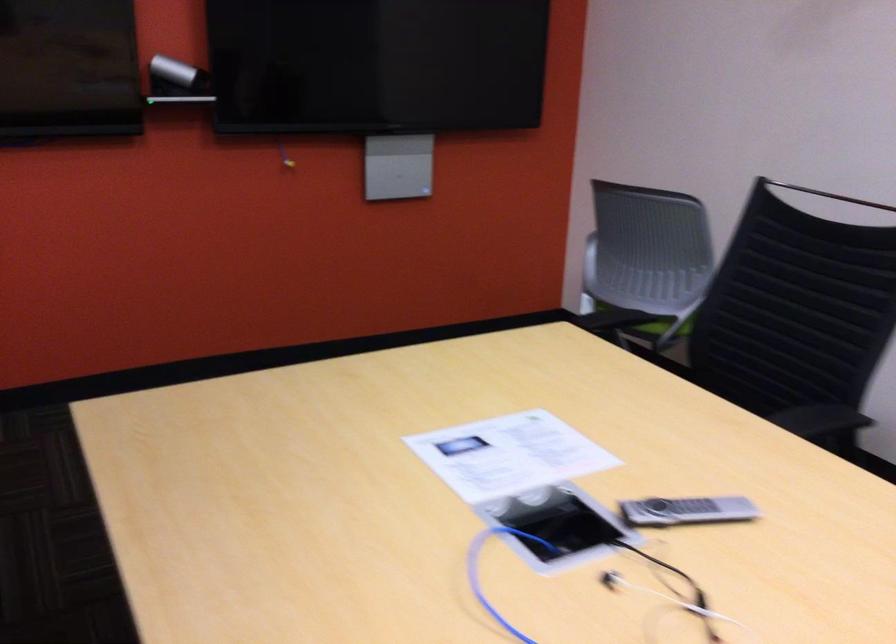
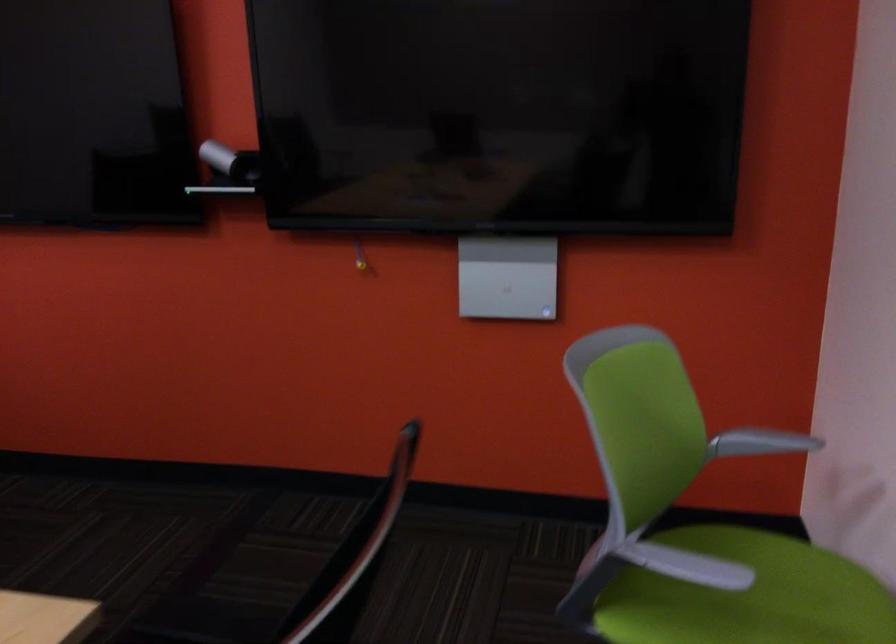
Find the pixel in the second image that matches [681,290] in the first image.

(747, 596)